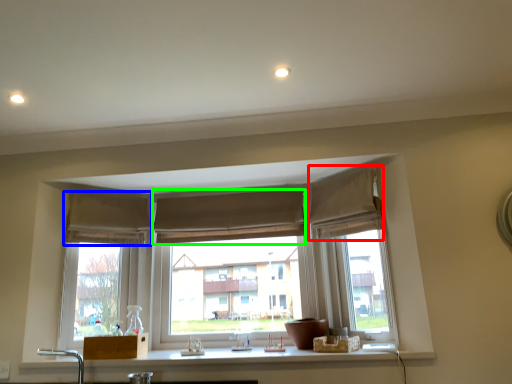
Question: Which is nearer to the curtain (highlighted by a red box)? curtain (highlighted by a blue box) or curtain (highlighted by a green box).

Choices:
 (A) curtain
 (B) curtain

Answer: (B)